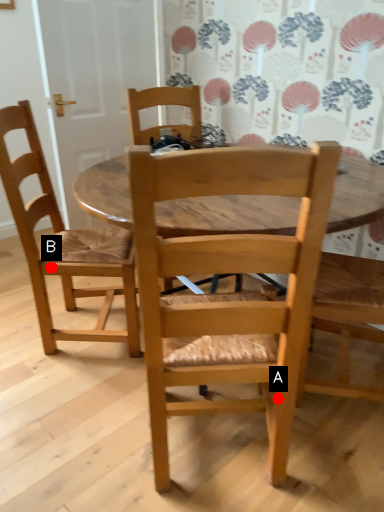
Question: Two points are circled on the image, labeled by A and B beside each circle. Which point is closer to the camera?

Choices:
 (A) A is closer
 (B) B is closer

Answer: (A)